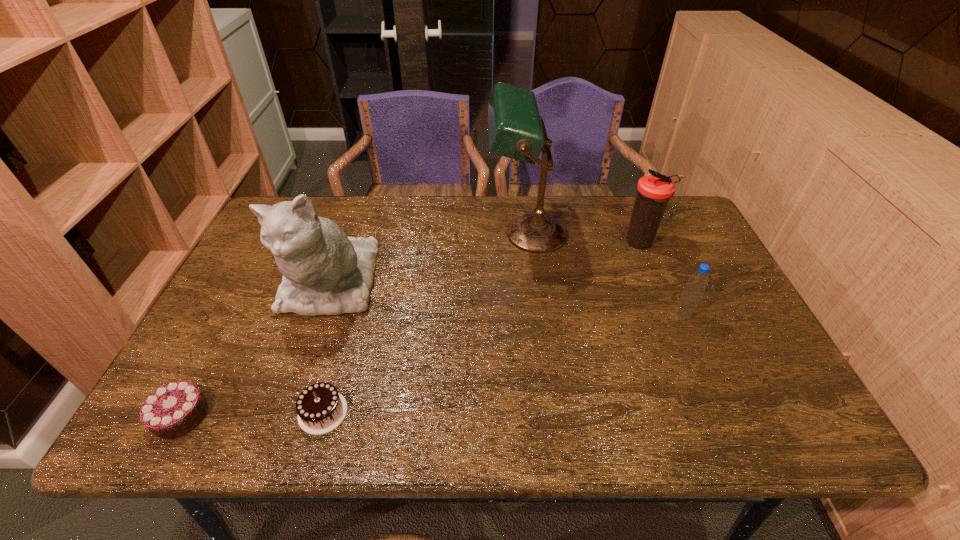
Image resolution: width=960 pixels, height=540 pixels. Identify the location of the tallest object. (516, 130).

I want to click on table lamp, so click(516, 130).

The image size is (960, 540). I want to click on cat, so click(x=325, y=272).

Where is `thermos bottle`? The height and width of the screenshot is (540, 960). thermos bottle is located at coordinates (653, 191).

At what (x,y) coordinates should I click in order to perform the action: click on water bottle. Please return your answer as a coordinate pair (x, y). Looking at the image, I should click on (696, 284).

Identify the location of the right chocolate cake. The image size is (960, 540). (320, 408).

This screenshot has width=960, height=540. I want to click on the leftmost object, so click(x=173, y=410).

Image resolution: width=960 pixels, height=540 pixels. I want to click on free space located 0.350m above the green lampshade of the tallest object, so click(372, 234).

The height and width of the screenshot is (540, 960). In order to click on free location located 0.250m above the green lampshade of the tallest object in this screenshot , I will do `click(405, 234)`.

Identify the location of vacant space located above the green lampshade of the tallest object. The image size is (960, 540). (375, 234).